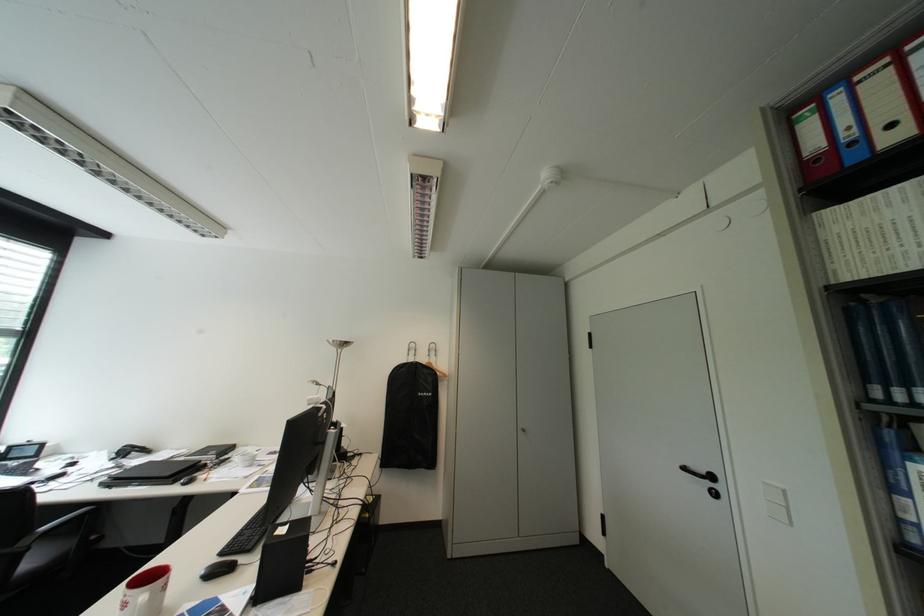
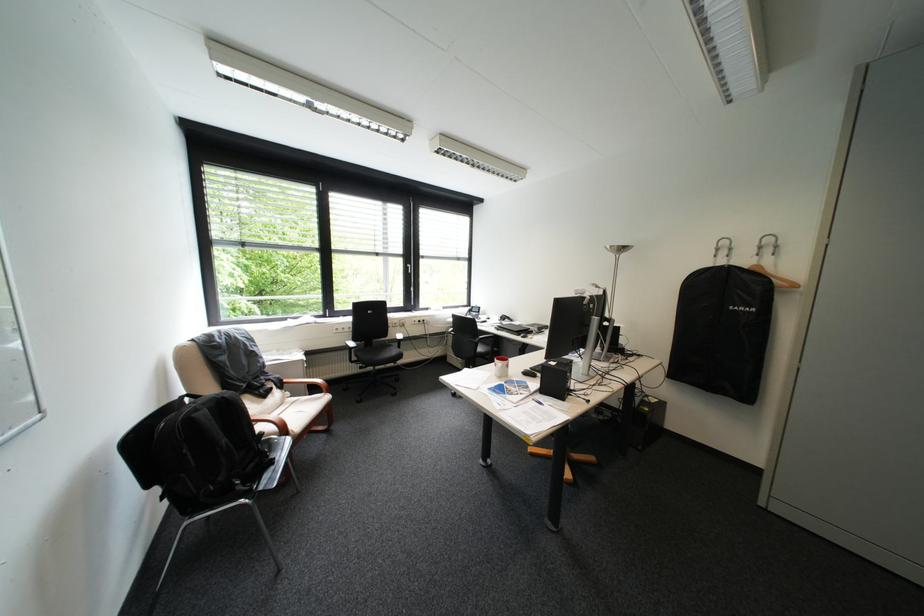
Find the pixel in the second image that matches (436,363) in the first image.

(759, 268)